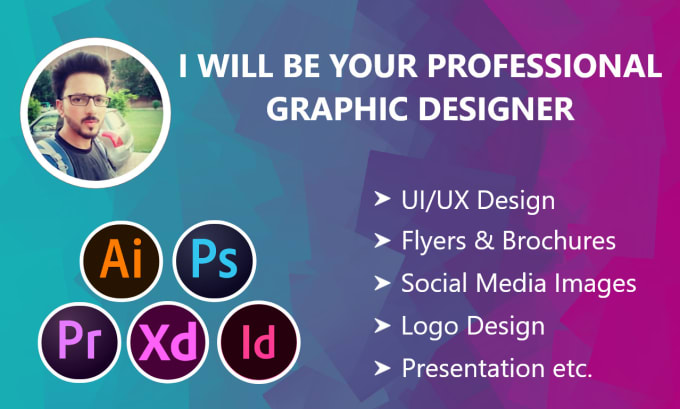
Locate an element on the screen. window is located at coordinates (48, 128).